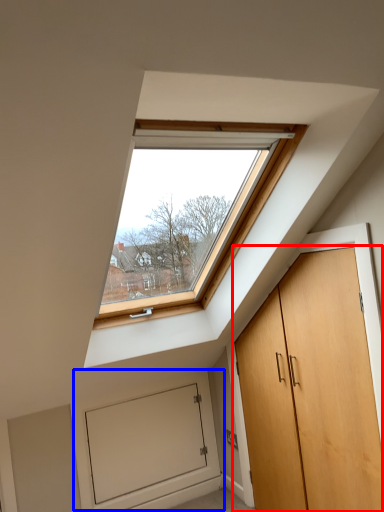
Question: Which object is closer to the camera taking this photo, door (highlighted by a red box) or garage door (highlighted by a blue box)?

Choices:
 (A) door
 (B) garage door

Answer: (A)